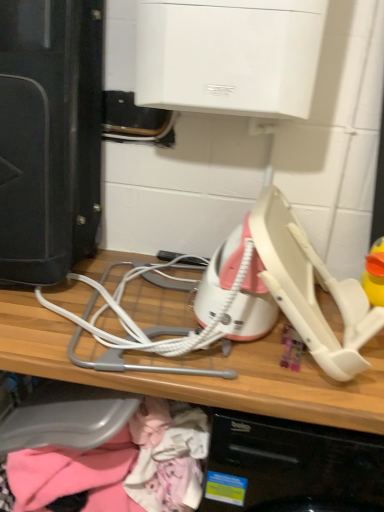
Question: Is pink fabric at lower left in front of white plastic computer at center?

Choices:
 (A) yes
 (B) no

Answer: (B)

Question: Is pink fabric at lower left at the right side of white plastic computer at center?

Choices:
 (A) no
 (B) yes

Answer: (A)

Question: Would you say pink fabric at lower left is a long distance from white plastic computer at center?

Choices:
 (A) yes
 (B) no

Answer: (B)

Question: Is pink fabric at lower left outside of white plastic computer at center?

Choices:
 (A) yes
 (B) no

Answer: (B)

Question: Does pink fabric at lower left appear on the left side of white plastic computer at center?

Choices:
 (A) yes
 (B) no

Answer: (A)

Question: In terms of width, does white plastic computer at center look wider or thinner when compared to pink fabric at lower left?

Choices:
 (A) thin
 (B) wide

Answer: (B)

Question: Based on their positions, is white plastic computer at center located to the left or right of pink fabric at lower left?

Choices:
 (A) right
 (B) left

Answer: (A)

Question: Is white plastic computer at center taller or shorter than pink fabric at lower left?

Choices:
 (A) short
 (B) tall

Answer: (B)

Question: Is white plastic computer at center bigger or smaller than pink fabric at lower left?

Choices:
 (A) small
 (B) big

Answer: (B)

Question: Considering their positions, is black plastic speaker at left located in front of or behind white plastic computer at center?

Choices:
 (A) behind
 (B) front

Answer: (A)

Question: Is black plastic speaker at left bigger or smaller than white plastic computer at center?

Choices:
 (A) big
 (B) small

Answer: (B)

Question: Considering the positions of black plastic speaker at left and white plastic computer at center in the image, is black plastic speaker at left wider or thinner than white plastic computer at center?

Choices:
 (A) wide
 (B) thin

Answer: (B)

Question: From a real-world perspective, is black plastic speaker at left above or below white plastic computer at center?

Choices:
 (A) below
 (B) above

Answer: (B)

Question: Is pink fabric at lower left inside or outside of white plastic computer at center?

Choices:
 (A) outside
 (B) inside

Answer: (B)

Question: Considering their positions, is pink fabric at lower left located in front of or behind white plastic computer at center?

Choices:
 (A) behind
 (B) front

Answer: (A)